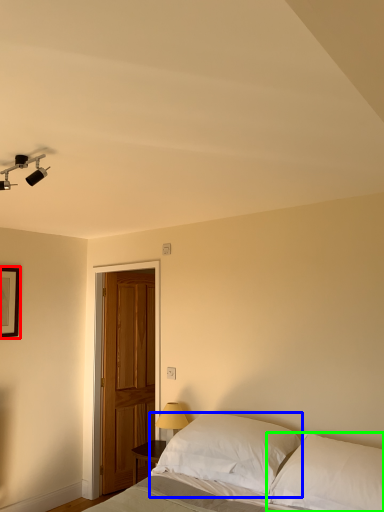
Question: Estimate the real-world distances between objects in this image. Which object is farther from picture frame (highlighted by a red box), pillow (highlighted by a blue box) or pillow (highlighted by a green box)?

Choices:
 (A) pillow
 (B) pillow

Answer: (B)